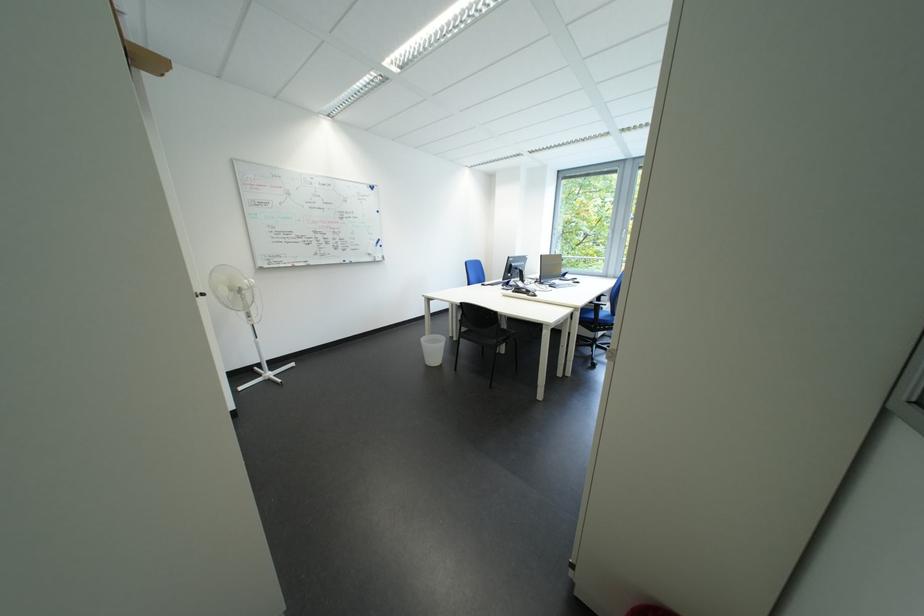
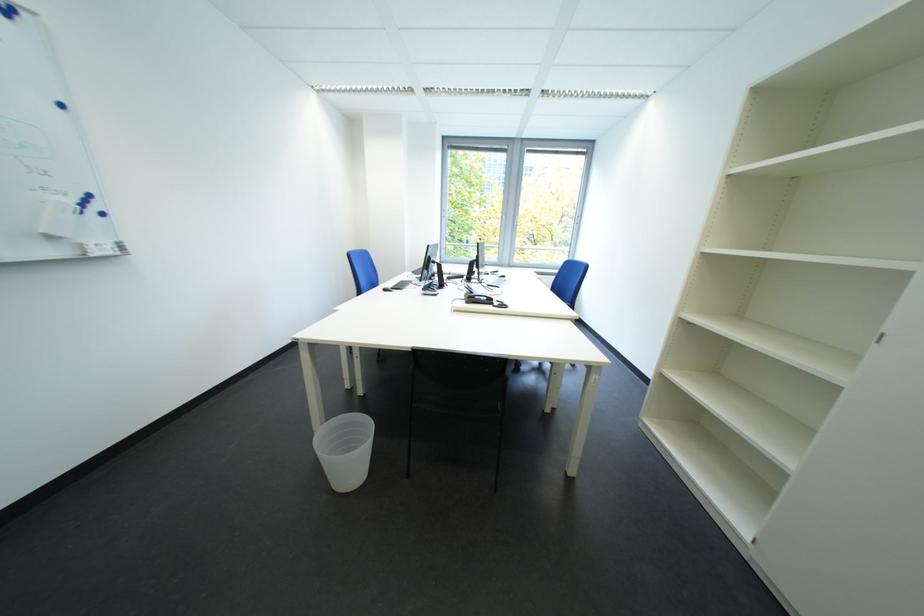
Locate, in the second image, the point that corresponds to (x=384, y=190) in the first image.

(17, 12)